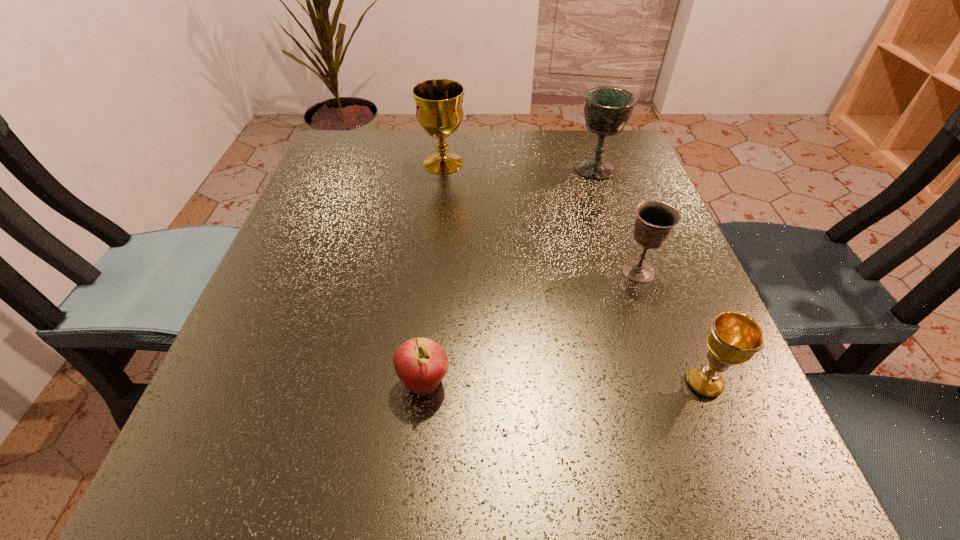
The height and width of the screenshot is (540, 960). What are the coordinates of `free space at the near edge of the desktop` in the screenshot? It's located at (536, 463).

At what (x,y) coordinates should I click in order to perform the action: click on free space at the left edge of the desktop. Please return your answer as a coordinate pair (x, y). Image resolution: width=960 pixels, height=540 pixels. Looking at the image, I should click on (300, 440).

Identify the location of blank space at the right edge. (647, 264).

Identify the location of vacant space at the far right corner of the desktop. Image resolution: width=960 pixels, height=540 pixels. (612, 139).

What are the coordinates of `empty location between the leftmost chalice and the nearest chalice` in the screenshot? It's located at (573, 273).

Where is `vacant space in between the leftmost chalice and the nearest chalice`? Image resolution: width=960 pixels, height=540 pixels. vacant space in between the leftmost chalice and the nearest chalice is located at coordinates (573, 273).

In order to click on free point between the leftmost chalice and the nearest chalice in this screenshot , I will do `click(573, 273)`.

At what (x,y) coordinates should I click in order to perform the action: click on vacant point located between the leftmost chalice and the apple. Please return your answer as a coordinate pair (x, y). The width and height of the screenshot is (960, 540). Looking at the image, I should click on (434, 273).

Identify the location of empty location between the shortest object and the leftmost chalice. (434, 273).

The image size is (960, 540). In order to click on vacant space in between the second nearest chalice and the shortest object in this screenshot , I will do `click(531, 327)`.